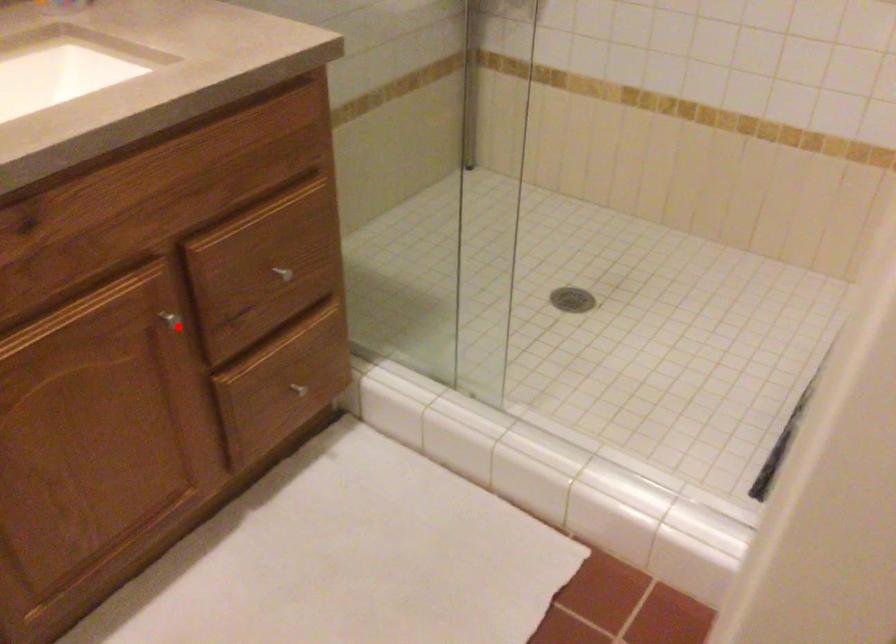
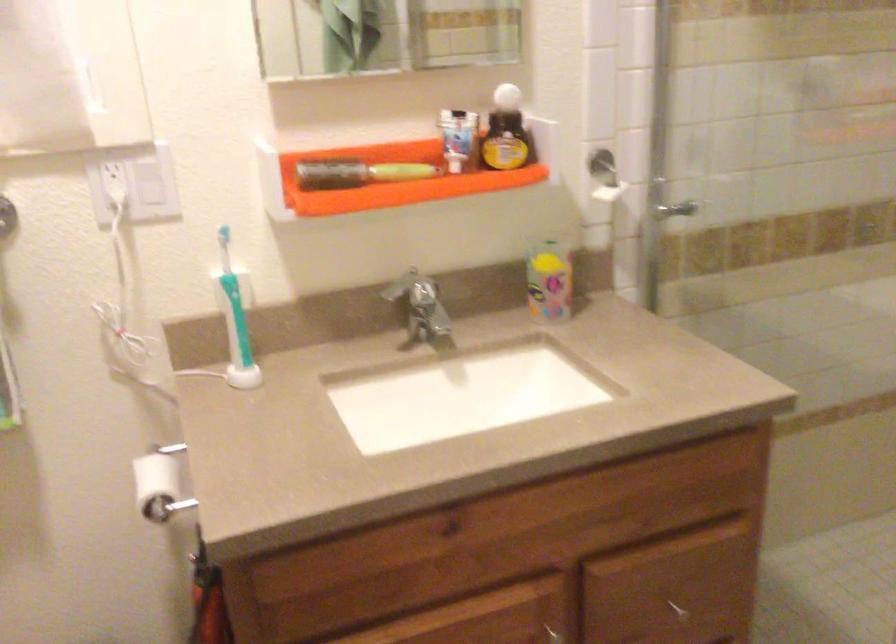
In the second image, find the point that corresponds to the highlighted location in the first image.

(555, 635)